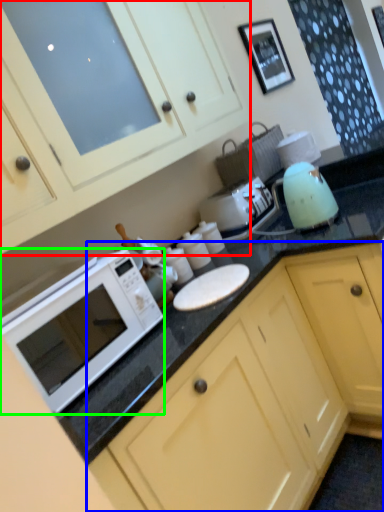
Question: Which is farther away from cabinetry (highlighted by a red box)? cabinetry (highlighted by a blue box) or microwave oven (highlighted by a green box)?

Choices:
 (A) cabinetry
 (B) microwave oven

Answer: (A)